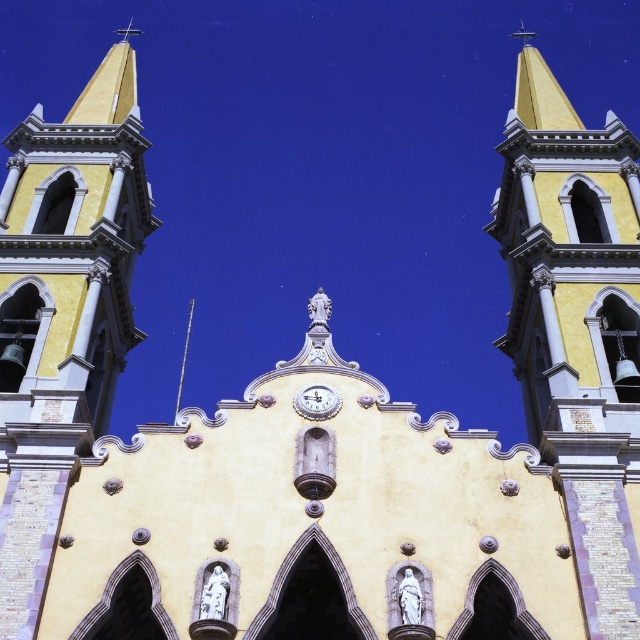
Question: Estimate the real-world distances between objects in this image. Which object is farther from the yellow stucco bell tower at left?

Choices:
 (A) white glossy clock at center
 (B) smooth yellow steeple at upper center
 (C) shiny silver spire at center

Answer: (C)

Question: Is smooth yellow steeple at upper center to the right of shiny silver spire at center from the viewer's perspective?

Choices:
 (A) no
 (B) yes

Answer: (B)

Question: Which point is closer to the camera taking this photo?

Choices:
 (A) (332, 397)
 (B) (58, 317)
 (C) (627, 368)

Answer: (A)

Question: Which point is closer to the camera?

Choices:
 (A) (317, 403)
 (B) (65, 243)
 (C) (188, 349)
 (D) (630, 548)

Answer: (D)

Question: Is yellow stucco bell tower at left to the right of white glossy clock at center from the viewer's perspective?

Choices:
 (A) yes
 (B) no

Answer: (B)

Question: Does yellow stucco bell tower at left appear on the right side of shiny silver spire at center?

Choices:
 (A) no
 (B) yes

Answer: (B)